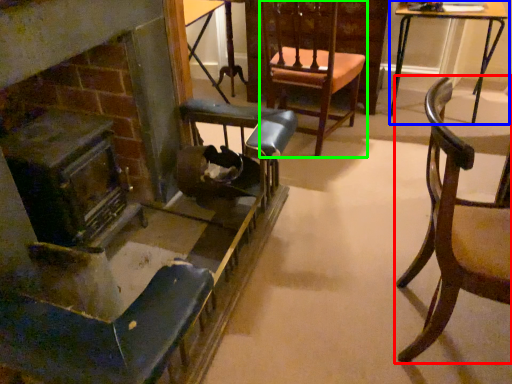
Question: Based on their relative distances, which object is nearer to chair (highlighted by a red box)? Choose from table (highlighted by a blue box) and chair (highlighted by a green box).

Choices:
 (A) table
 (B) chair

Answer: (B)